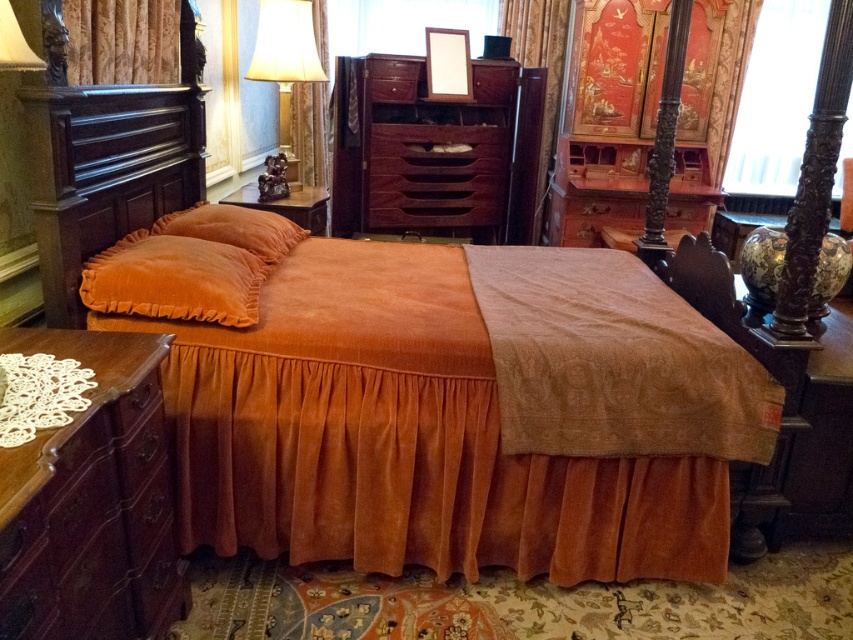
Question: Is mahogany wood dresser at center wider than velvet curtain at upper left?

Choices:
 (A) no
 (B) yes

Answer: (B)

Question: From the image, what is the correct spatial relationship of velvet orange blanket at center in relation to mahogany drawer at center?

Choices:
 (A) right
 (B) left

Answer: (A)

Question: Does mahogany drawer at center appear on the right side of velvet orange pillow at upper left?

Choices:
 (A) no
 (B) yes

Answer: (B)

Question: Among these points, which one is farthest from the camera?

Choices:
 (A) (96, 508)
 (B) (485, 131)
 (C) (641, 426)

Answer: (B)

Question: Which of the following is the closest to the observer?

Choices:
 (A) (403, 77)
 (B) (175, 234)
 (C) (192, 316)
 (D) (508, 381)

Answer: (D)

Question: Which is farther from the velvet orange pillow at upper center?

Choices:
 (A) matte gold lamp at upper left
 (B) mahogany wood dresser at lower left
 (C) mahogany wood dresser at center
 (D) mahogany drawer at center

Answer: (C)